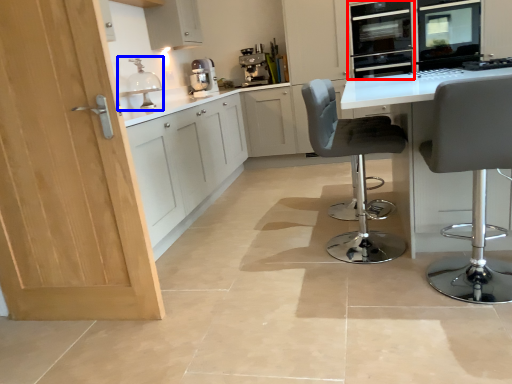
Question: Which object is further to the camera taking this photo, oven (highlighted by a red box) or sink (highlighted by a blue box)?

Choices:
 (A) oven
 (B) sink

Answer: (A)